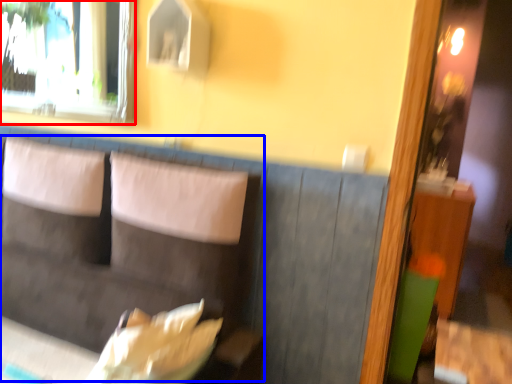
Question: Which object appears closest to the camera in this image, window (highlighted by a red box) or couch (highlighted by a blue box)?

Choices:
 (A) window
 (B) couch

Answer: (B)